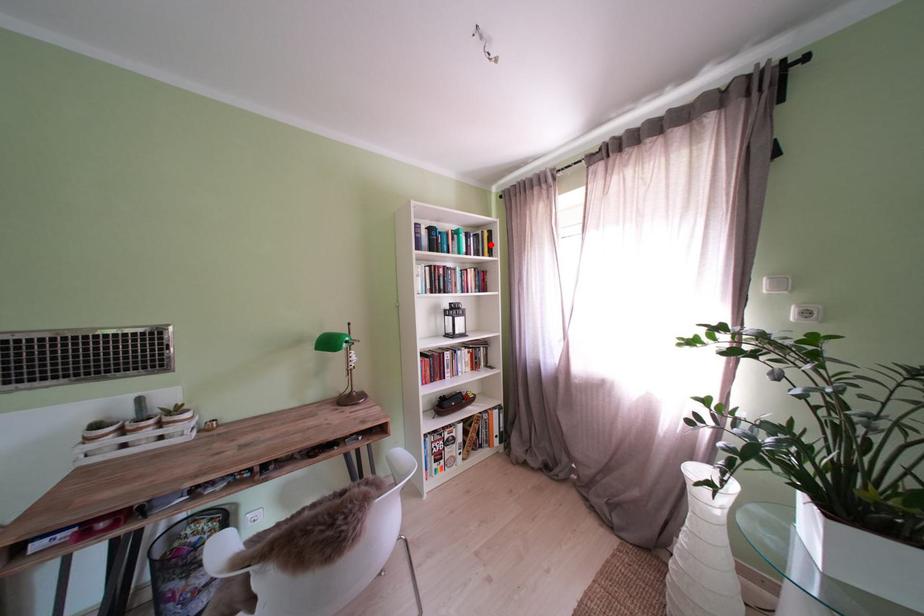
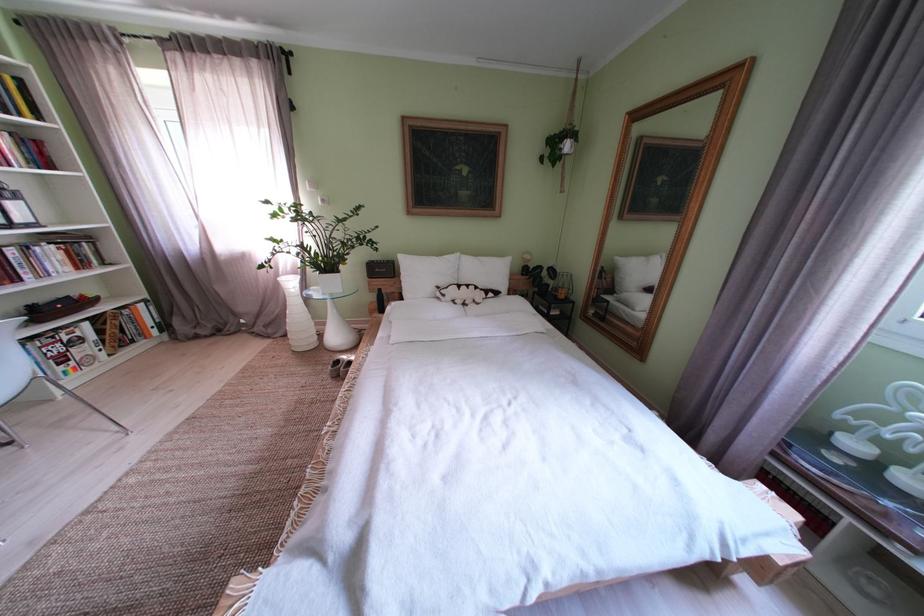
Question: A red point is marked in image1. In image2, is the corresponding 3D point closer to the camera or farther? Reply with the corresponding letter.

Choices:
 (A) The corresponding 3D point is closer.
 (B) The corresponding 3D point is farther.

Answer: (B)